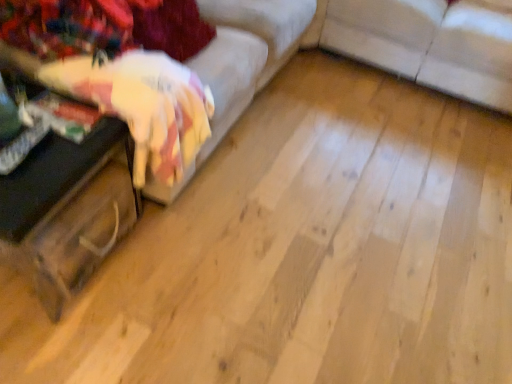
Question: Is wooden trunk at left taller or shorter than velvet fabric couch at left, positioned as the first studio couch in left-to-right order?

Choices:
 (A) tall
 (B) short

Answer: (B)

Question: Considering their positions, is wooden trunk at left located in front of or behind velvet fabric couch at left, which is counted as the second studio couch, starting from the right?

Choices:
 (A) behind
 (B) front

Answer: (A)

Question: Which of these objects is positioned farthest from the velvet fabric couch at left, positioned as the first studio couch in left-to-right order?

Choices:
 (A) white fabric couch at center, placed as the first studio couch when sorted from right to left
 (B) wooden trunk at left

Answer: (A)

Question: Based on their relative distances, which object is farther from the velvet fabric couch at left, positioned as the first studio couch in left-to-right order?

Choices:
 (A) wooden trunk at left
 (B) white fabric couch at center, positioned as the 2th studio couch in left-to-right order

Answer: (B)